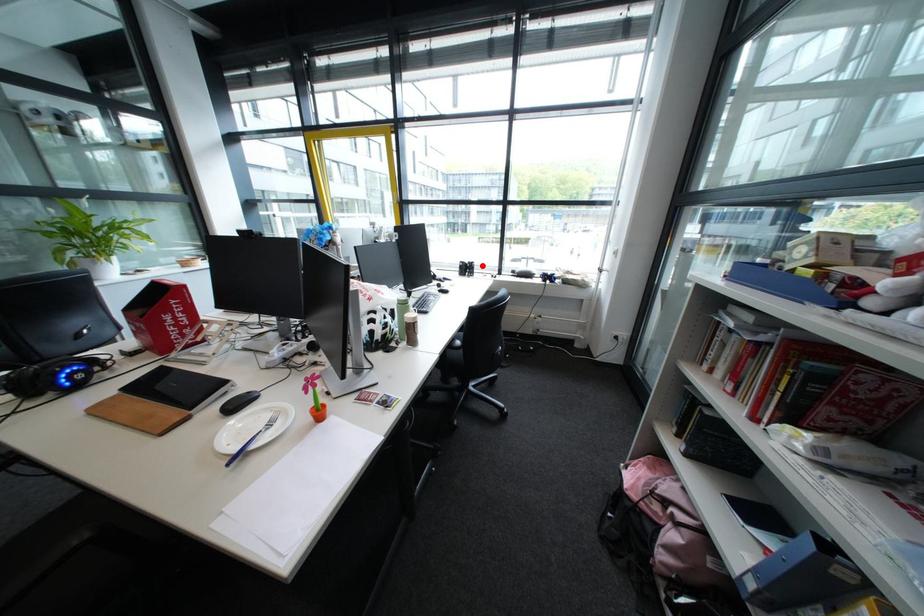
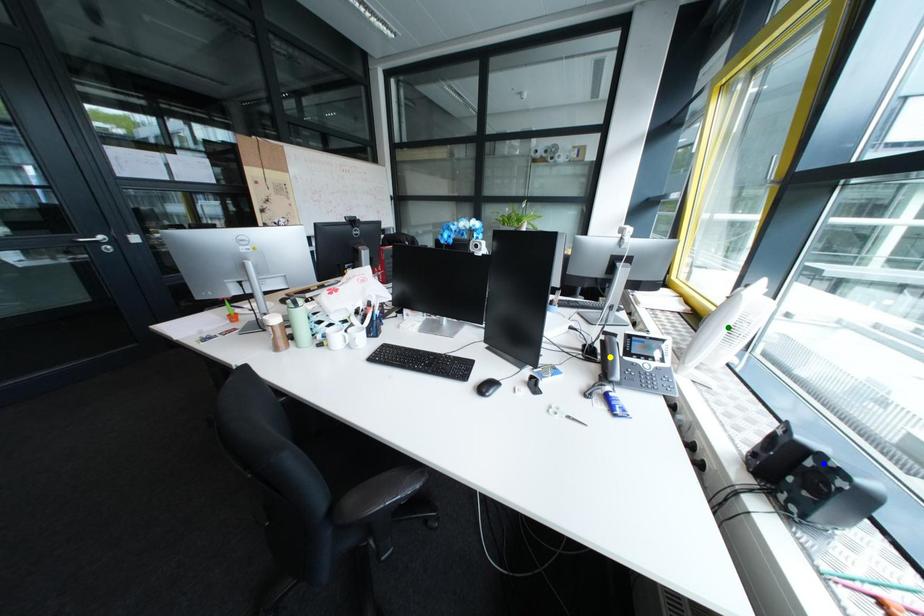
Question: I am providing you with two images of the same scene from different viewpoints. A red point is marked on the first image. You are given multiple points on the second image. Which mark in image 2 goes with the point in image 1?

Choices:
 (A) blue point
 (B) yellow point
 (C) green point

Answer: (A)